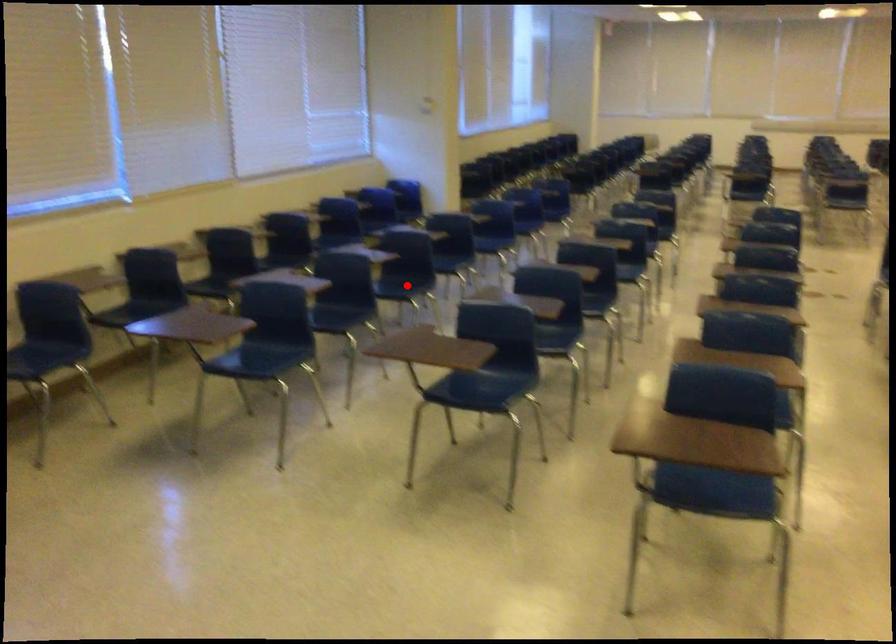
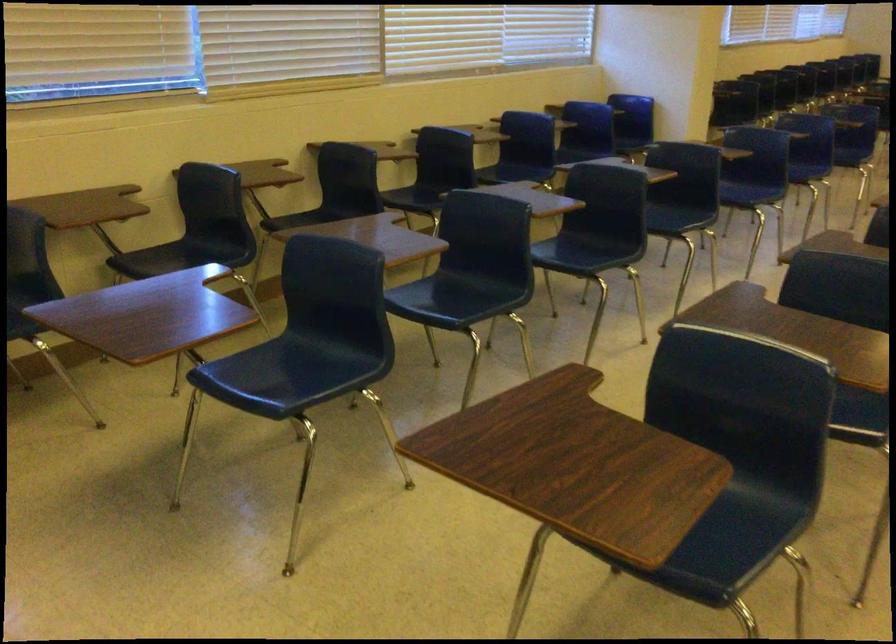
The point at the highlighted location is marked in the first image. Where is the corresponding point in the second image?

(586, 252)